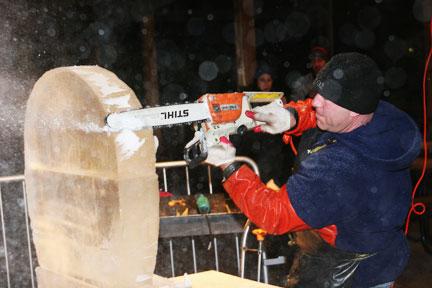
Find the location of `base of the wooden slab`. base of the wooden slab is located at coordinates (42, 268), (82, 277), (116, 286).